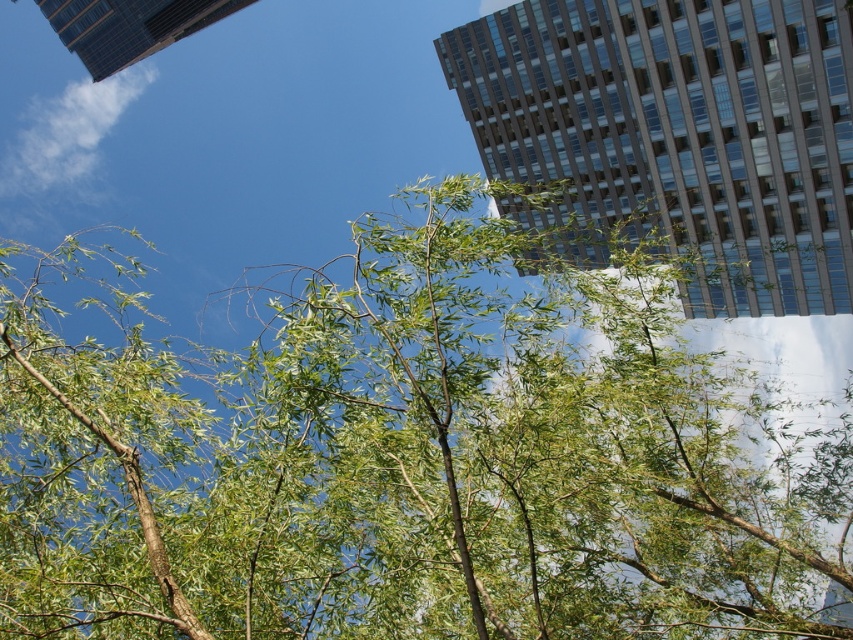
You are an urban planner assessing the potential for a new sculpture installation between the glassy reflective building at upper right and the glassy steel skyscraper at upper left. Based on their widths, which building would allow for a wider base for the sculpture?

The glassy steel skyscraper at upper left has a greater width than the glassy reflective building at upper right, so it would provide a wider base for the sculpture installation.

Based on the photo, you are a bird flying over the city. You want to land on the green leafy branches at center but need to avoid the glassy steel skyscraper at upper left. Which direction should you fly to reach the branches safely?

The green leafy branches at center is below the glassy steel skyscraper at upper left, so you should fly downward towards the branches to avoid the skyscraper.